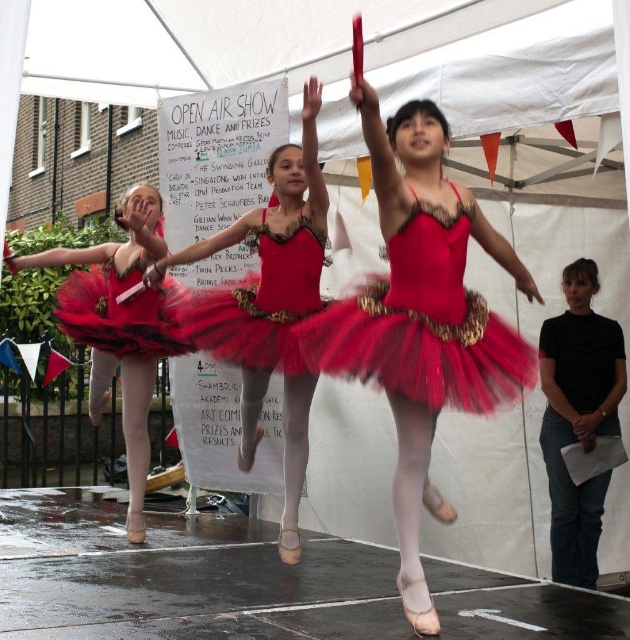
Question: Among these points, which one is farthest from the camera?

Choices:
 (A) (110, 316)
 (B) (106, 259)

Answer: (B)

Question: Can you confirm if shiny red tutu at center is positioned below matte black ballet dancer at center?

Choices:
 (A) no
 (B) yes

Answer: (A)

Question: Which point is farther to the camera?

Choices:
 (A) (186, 326)
 (B) (522, 285)
 (C) (294, 193)
 (D) (554, 401)

Answer: (D)

Question: Is matte red tutu at center below shiny tulle skirt at center?

Choices:
 (A) yes
 (B) no

Answer: (B)

Question: Estimate the real-world distances between objects in this image. Which object is farther from the matte black ballet dancer at center?

Choices:
 (A) shiny tulle dress at center
 (B) shiny red tutu at center
 (C) red tulle tutu at left

Answer: (C)

Question: Is shiny red tutu at center to the right of matte black ballet dancer at center from the viewer's perspective?

Choices:
 (A) no
 (B) yes

Answer: (A)